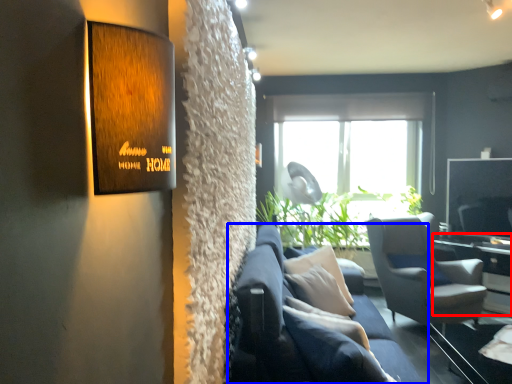
Question: Which object appears farthest to the camera in this image, table (highlighted by a red box) or studio couch (highlighted by a blue box)?

Choices:
 (A) table
 (B) studio couch

Answer: (A)